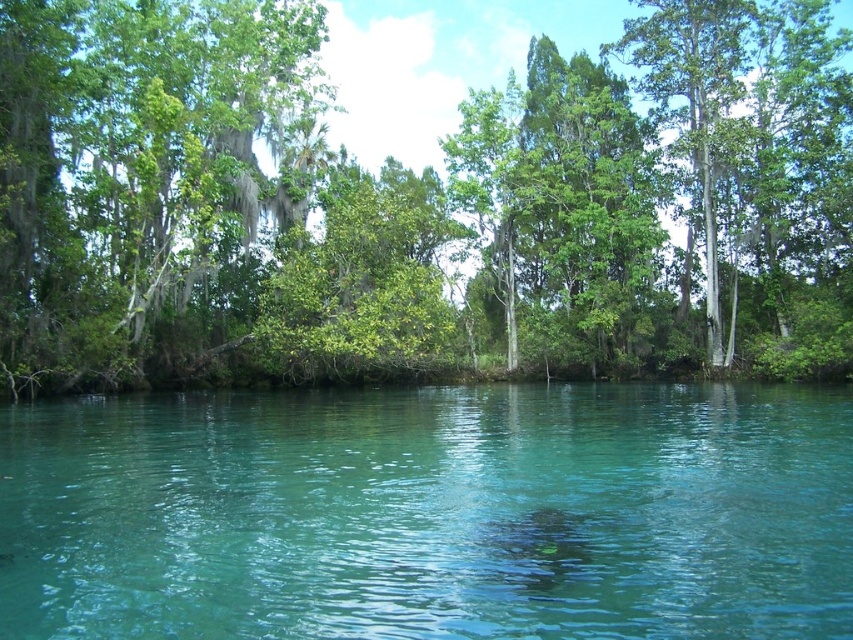
You are standing at the edge of the water in the image and notice a point marked at coordinates (430,513). What does this point indicate about the water at that location?

The point at (430,513) marks clear water at center, meaning the water there is transparent and free of obstructions.

You are standing at the edge of the water and want to take a photo of both the green leafy tree at center and the clear water at center. Which object should you focus on first to ensure both are in the frame?

You should focus on the green leafy tree at center first because it is in front of the clear water at center, so adjusting the focus to include the tree will naturally include the water behind it in the frame as well.

You are standing on a path near the center of the scene. You want to walk to the green leafy tree at center and then to the clear water at center. Which object will you encounter first?

You will encounter the clear water at center first because the green leafy tree at center is wider than the clear water at center, meaning the tree is further away from the path.